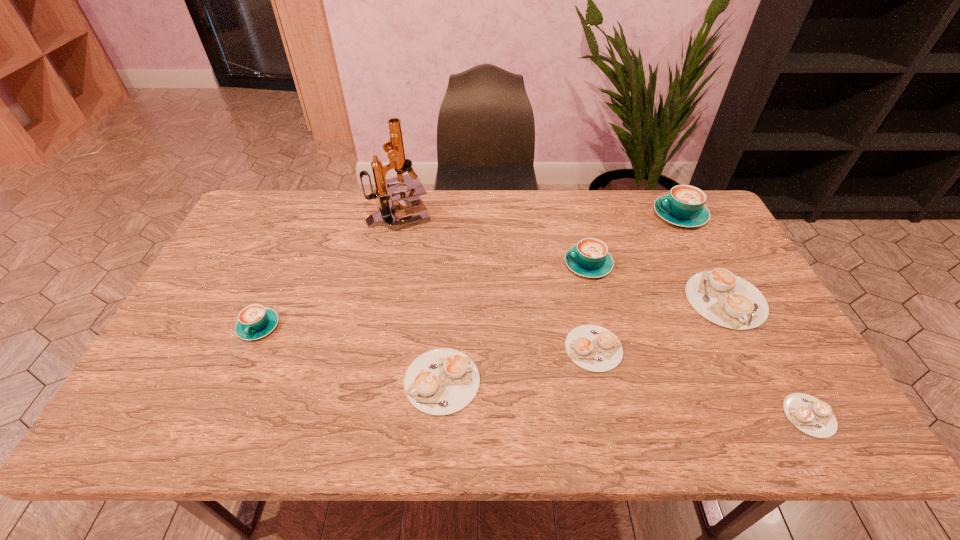
Identify which cappuccino is the closest to the third shortest object. Please provide its 2D coordinates. Your answer should be formatted as a tuple, i.e. [(x, y)], where the tuple contains the x and y coordinates of a point satisfying the conditions above.

[(594, 348)]

Select which turquoise cappuccino is the closest to the second biggest turquoise cappuccino. Please provide its 2D coordinates. Your answer should be formatted as a tuple, i.e. [(x, y)], where the tuple contains the x and y coordinates of a point satisfying the conditions above.

[(684, 206)]

Where is `the second closest turquoise cappuccino to the microscope`? The height and width of the screenshot is (540, 960). the second closest turquoise cappuccino to the microscope is located at coordinates tap(589, 258).

At what (x,y) coordinates should I click in order to perform the action: click on white cappuccino object that ranks as the closest to the leftmost cappuccino. Please return your answer as a coordinate pair (x, y). The image size is (960, 540). Looking at the image, I should click on (442, 381).

Where is `white cappuccino that stands as the closest to the smallest white cappuccino`? white cappuccino that stands as the closest to the smallest white cappuccino is located at coordinates (721, 297).

The width and height of the screenshot is (960, 540). Find the location of `vacant space that satisfies the following two spatial constraints: 1. on the back side of the third biggest white cappuccino; 2. at the eyepiece of the gold microscope`. vacant space that satisfies the following two spatial constraints: 1. on the back side of the third biggest white cappuccino; 2. at the eyepiece of the gold microscope is located at coordinates (564, 214).

I want to click on free location that satisfies the following two spatial constraints: 1. at the eyepiece of the second shortest object; 2. on the left side of the microscope, so click(x=372, y=348).

The image size is (960, 540). In order to click on free space that satisfies the following two spatial constraints: 1. with the handle on the right side of the rightmost turquoise cappuccino; 2. on the front side of the second biggest white cappuccino in this screenshot , I will do `click(763, 381)`.

Where is `free space that satisfies the following two spatial constraints: 1. at the eyepiece of the gold microscope; 2. with the handle on the right side of the fifth shortest cappuccino`? The width and height of the screenshot is (960, 540). free space that satisfies the following two spatial constraints: 1. at the eyepiece of the gold microscope; 2. with the handle on the right side of the fifth shortest cappuccino is located at coordinates (376, 327).

I want to click on free spot that satisfies the following two spatial constraints: 1. with the handle on the right side of the seventh tallest object; 2. on the left side of the leftmost turquoise cappuccino, so click(250, 348).